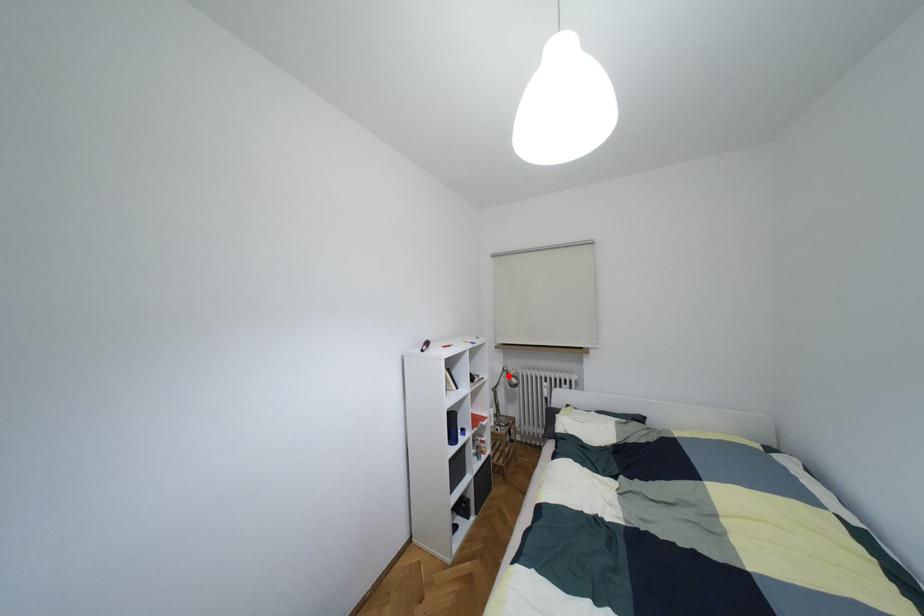
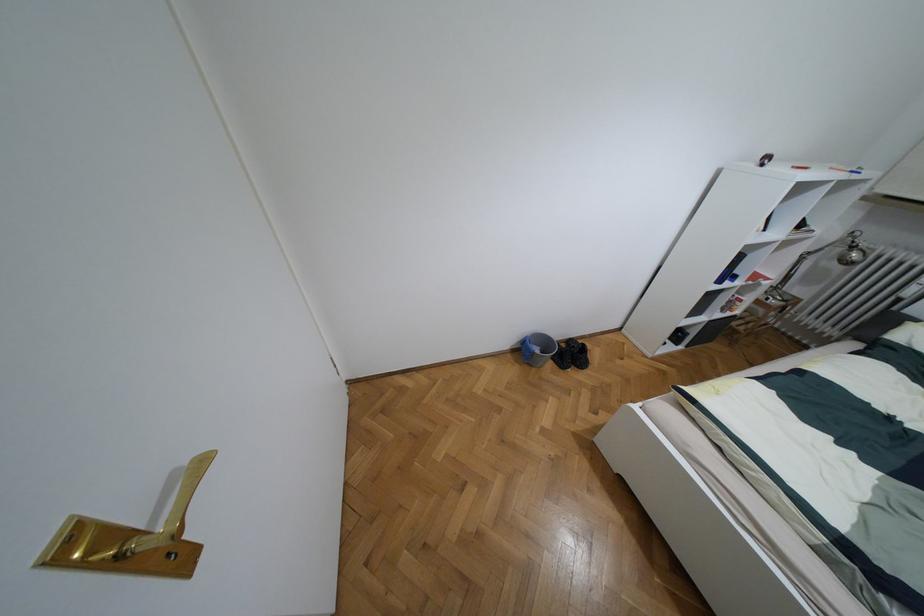
Question: I am providing you with two images of the same scene from different viewpoints. In image1, a red point is highlighted. Considering the same 3D point in image2, which of the following is correct?

Choices:
 (A) It is closer
 (B) It is farther

Answer: (B)